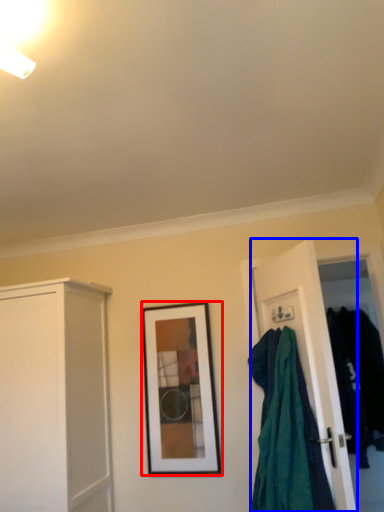
Question: Which object appears farthest to the camera in this image, picture frame (highlighted by a red box) or door (highlighted by a blue box)?

Choices:
 (A) picture frame
 (B) door

Answer: (A)